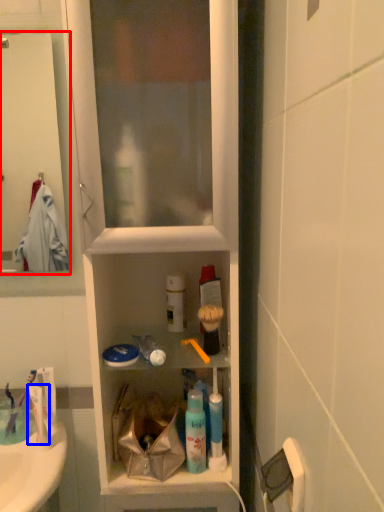
Question: Among these objects, which one is farthest to the camera, screen door (highlighted by a red box) or toothpaste (highlighted by a blue box)?

Choices:
 (A) screen door
 (B) toothpaste

Answer: (B)